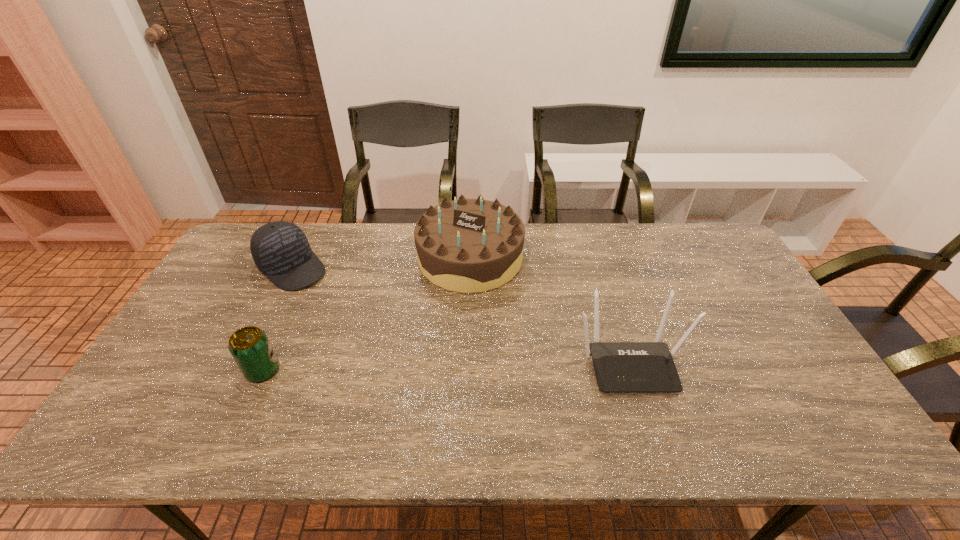
This screenshot has width=960, height=540. Identify the location of empty space between the birthday cake and the router. click(x=550, y=310).

You are a GUI agent. You are given a task and a screenshot of the screen. Output one action in this format:
    pyautogui.click(x=<x>, y=<y>)
    Task: Click on the free spot between the baseball cap and the rightmost object
    This screenshot has height=540, width=960.
    Given the screenshot: What is the action you would take?
    pyautogui.click(x=461, y=315)

Find the location of `free space that is in between the beer can and the third object from left to right`. free space that is in between the beer can and the third object from left to right is located at coordinates (367, 314).

The image size is (960, 540). Identify the location of object that stands as the third closest to the baseball cap. pyautogui.click(x=620, y=367).

Locate an element on the screen. The image size is (960, 540). object that is the third closest to the router is located at coordinates (249, 346).

I want to click on vacant area in the image that satisfies the following two spatial constraints: 1. on the back side of the second object from right to left; 2. on the right side of the beer can, so click(312, 258).

The width and height of the screenshot is (960, 540). Find the location of `free location that satisfies the following two spatial constraints: 1. on the back side of the second object from right to left; 2. on the right side of the beer can`. free location that satisfies the following two spatial constraints: 1. on the back side of the second object from right to left; 2. on the right side of the beer can is located at coordinates (312, 258).

The height and width of the screenshot is (540, 960). I want to click on vacant space that satisfies the following two spatial constraints: 1. on the back side of the beer can; 2. on the right side of the birthday cake, so click(312, 258).